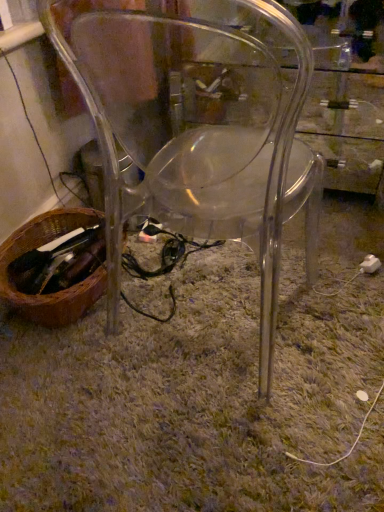
Find the location of a particular element. The height and width of the screenshot is (512, 384). free space to the back side of white plastic plug at lower right is located at coordinates (350, 240).